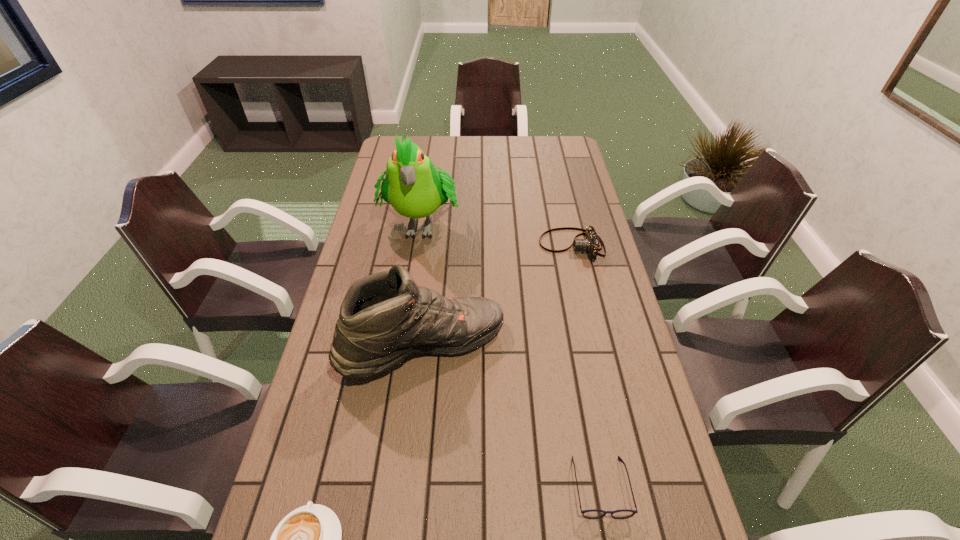
This screenshot has height=540, width=960. Find the location of `the tallest object`. the tallest object is located at coordinates (412, 185).

The image size is (960, 540). I want to click on the second tallest object, so click(x=385, y=317).

This screenshot has width=960, height=540. In order to click on ski boot in this screenshot , I will do `click(385, 317)`.

Locate an element on the screen. The height and width of the screenshot is (540, 960). camera is located at coordinates (590, 244).

You are a GUI agent. You are given a task and a screenshot of the screen. Output one action in this format:
    pyautogui.click(x=<x>, y=<y>)
    Task: Click on the spectacles
    The width and height of the screenshot is (960, 540).
    Given the screenshot: What is the action you would take?
    pyautogui.click(x=593, y=513)

You are a GUI agent. You are given a task and a screenshot of the screen. Output one action in this format:
    pyautogui.click(x=<x>, y=<y>)
    Task: Click on the free region located on the beak of the tallest object
    
    Given the screenshot: What is the action you would take?
    pyautogui.click(x=410, y=292)

The height and width of the screenshot is (540, 960). I want to click on free space located 0.360m on the right of the third farthest object, so [636, 347].

The width and height of the screenshot is (960, 540). I want to click on free space located 0.230m on the front-facing side of the camera, so click(472, 246).

You are a GUI agent. You are given a task and a screenshot of the screen. Output one action in this format:
    pyautogui.click(x=<x>, y=<y>)
    Task: Click on the vacant position located 0.060m on the front-facing side of the camera
    
    Given the screenshot: What is the action you would take?
    pyautogui.click(x=522, y=246)

Where is `free space located on the front-facing side of the camera`? The width and height of the screenshot is (960, 540). free space located on the front-facing side of the camera is located at coordinates (475, 246).